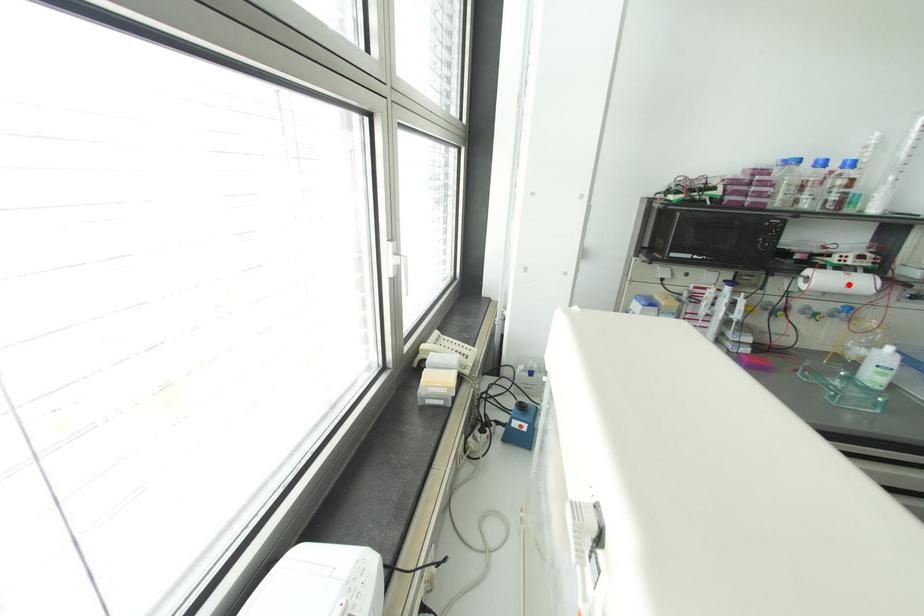
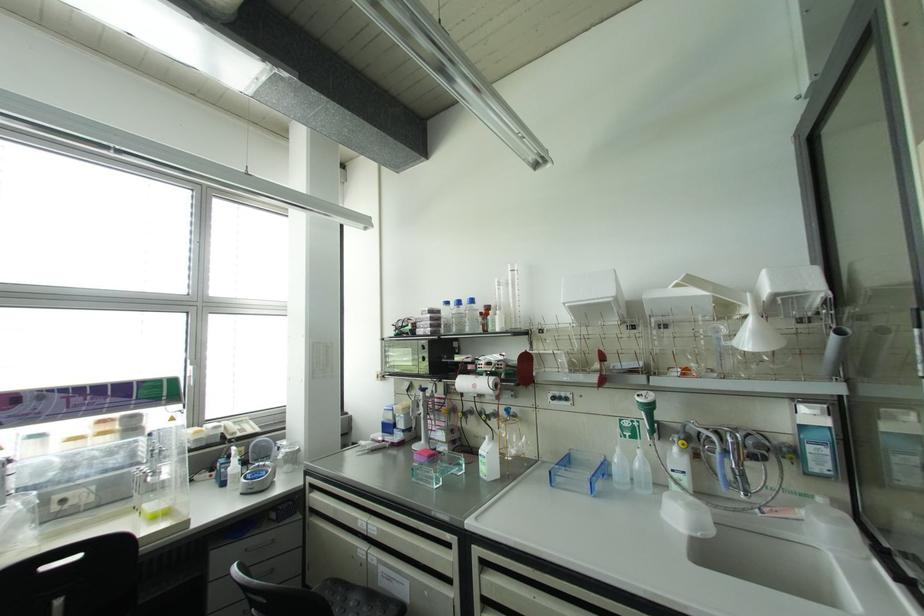
Locate, in the second image, the point that corresponds to the highlighted location in the first image.

(473, 386)